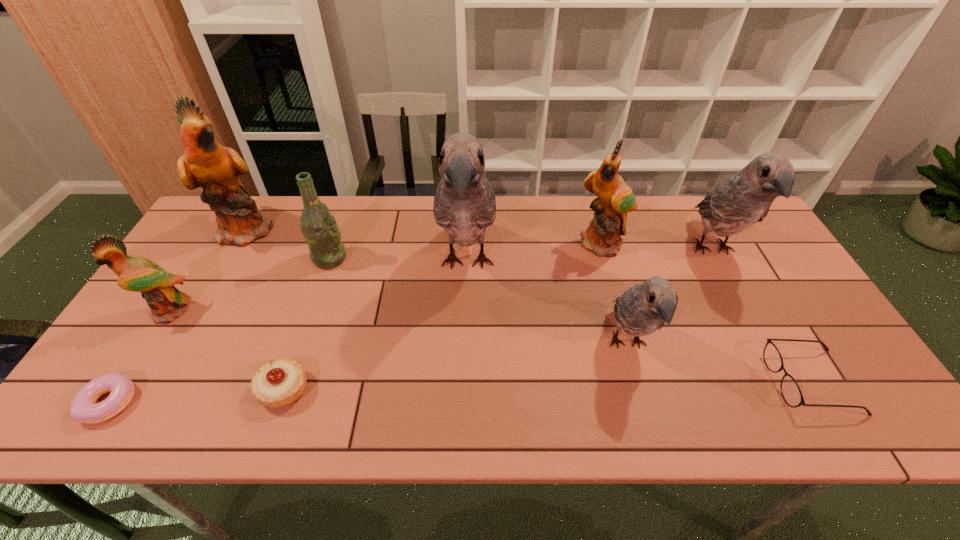
Find the location of a particular element. Image resolution: width=960 pixels, height=540 pixels. object that is the sixth closest to the second gray parrot from left to right is located at coordinates (320, 230).

At what (x,y) coordinates should I click in order to perform the action: click on object that is the eighth closest to the doughnut. Please return your answer as a coordinate pair (x, y). The image size is (960, 540). Looking at the image, I should click on point(741,200).

The width and height of the screenshot is (960, 540). Identify the location of parrot that stands as the third closest to the spectacles. (614, 199).

What are the coordinates of `parrot identified as the closest to the green beer bottle` in the screenshot? It's located at (205, 163).

I want to click on green parrot that stands as the third closest to the smallest gray parrot, so click(x=135, y=273).

Choose which green parrot is the third nearest neighbor to the shortest object. Please provide its 2D coordinates. Your answer should be formatted as a tuple, i.e. [(x, y)], where the tuple contains the x and y coordinates of a point satisfying the conditions above.

[(614, 199)]

Point out which gray parrot is positioned as the nearest to the biggest green parrot. Please provide its 2D coordinates. Your answer should be formatted as a tuple, i.e. [(x, y)], where the tuple contains the x and y coordinates of a point satisfying the conditions above.

[(464, 204)]

Locate an element on the screen. The width and height of the screenshot is (960, 540). gray parrot that is the nearest to the spectacles is located at coordinates (741, 200).

You are a GUI agent. You are given a task and a screenshot of the screen. Output one action in this format:
    pyautogui.click(x=<x>, y=<y>)
    Task: Click on the vacant region that satisfies the following two spatial constraints: 1. on the front-facing side of the biggest green parrot; 2. on the right side of the pastry
    
    Given the screenshot: What is the action you would take?
    pyautogui.click(x=157, y=390)